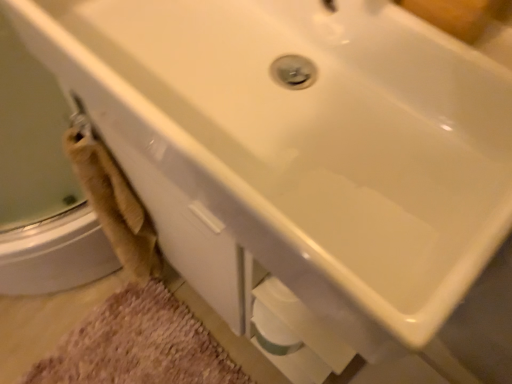
Question: Is beige fabric towel at left aimed at beige shaggy bath mat at lower left?

Choices:
 (A) yes
 (B) no

Answer: (B)

Question: Considering the relative positions of beige fabric towel at left and beige shaggy bath mat at lower left in the image provided, is beige fabric towel at left in front of beige shaggy bath mat at lower left?

Choices:
 (A) yes
 (B) no

Answer: (A)

Question: From the image's perspective, is beige fabric towel at left on top of beige shaggy bath mat at lower left?

Choices:
 (A) no
 (B) yes

Answer: (B)

Question: Can you confirm if beige fabric towel at left is positioned to the left of beige shaggy bath mat at lower left?

Choices:
 (A) yes
 (B) no

Answer: (B)

Question: Can you confirm if beige fabric towel at left is shorter than beige shaggy bath mat at lower left?

Choices:
 (A) yes
 (B) no

Answer: (B)

Question: Does beige fabric towel at left have a greater width compared to beige shaggy bath mat at lower left?

Choices:
 (A) no
 (B) yes

Answer: (A)

Question: From a real-world perspective, is beige shaggy bath mat at lower left below beige fabric towel at left?

Choices:
 (A) no
 (B) yes

Answer: (B)

Question: Considering the relative sizes of beige shaggy bath mat at lower left and beige fabric towel at left in the image provided, is beige shaggy bath mat at lower left bigger than beige fabric towel at left?

Choices:
 (A) no
 (B) yes

Answer: (A)

Question: Does beige shaggy bath mat at lower left turn towards beige fabric towel at left?

Choices:
 (A) no
 (B) yes

Answer: (A)

Question: Can you confirm if beige shaggy bath mat at lower left is thinner than beige fabric towel at left?

Choices:
 (A) no
 (B) yes

Answer: (A)

Question: Considering the relative sizes of beige shaggy bath mat at lower left and beige fabric towel at left in the image provided, is beige shaggy bath mat at lower left smaller than beige fabric towel at left?

Choices:
 (A) no
 (B) yes

Answer: (B)

Question: Considering the relative sizes of beige shaggy bath mat at lower left and beige fabric towel at left in the image provided, is beige shaggy bath mat at lower left wider than beige fabric towel at left?

Choices:
 (A) yes
 (B) no

Answer: (A)

Question: Considering the positions of beige fabric towel at left and beige shaggy bath mat at lower left in the image, is beige fabric towel at left bigger or smaller than beige shaggy bath mat at lower left?

Choices:
 (A) small
 (B) big

Answer: (B)